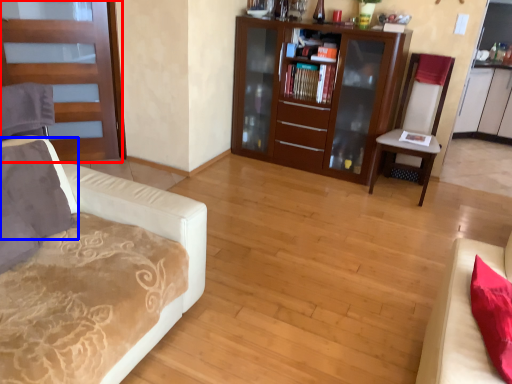
Question: Which object appears closest to the camera in this image, door (highlighted by a red box) or pillow (highlighted by a blue box)?

Choices:
 (A) door
 (B) pillow

Answer: (B)